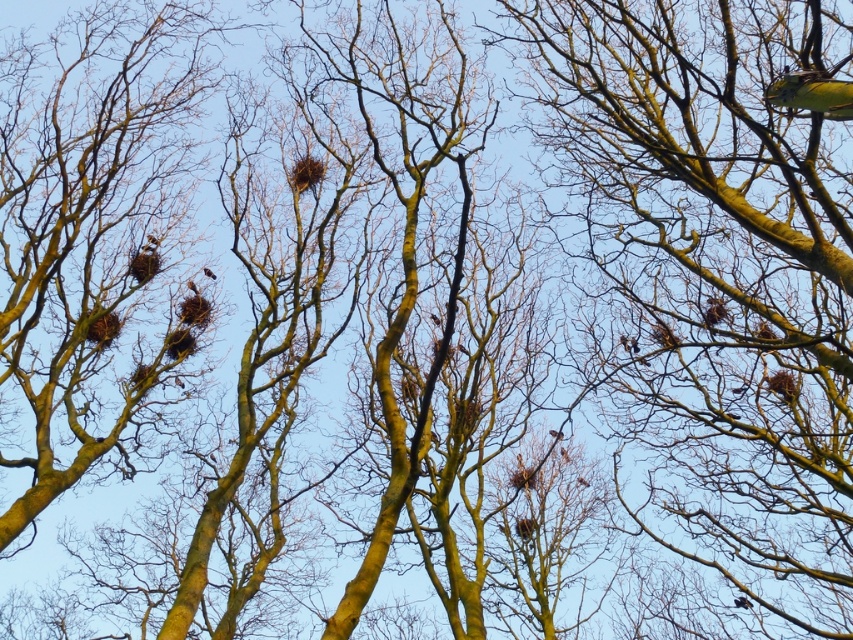
Question: Which of the following is the farthest from the observer?

Choices:
 (A) (788, 436)
 (B) (207, 275)

Answer: (B)

Question: Observing the image, what is the correct spatial positioning of smooth bark tree at upper right in reference to yellow-green feathers at upper right?

Choices:
 (A) right
 (B) left

Answer: (A)

Question: Can you confirm if yellow-green feathers at upper right is wider than brown fuzzy bird at upper center?

Choices:
 (A) no
 (B) yes

Answer: (B)

Question: Which object is positioned farthest from the yellow-green feathers at upper right?

Choices:
 (A) smooth bark tree at upper right
 (B) brown fuzzy bird at upper center

Answer: (A)

Question: Which object is positioned closest to the brown fuzzy bird at upper center?

Choices:
 (A) smooth bark tree at upper right
 (B) yellow-green feathers at upper right

Answer: (A)

Question: Can you confirm if smooth bark tree at upper right is positioned to the left of yellow-green feathers at upper right?

Choices:
 (A) yes
 (B) no

Answer: (B)